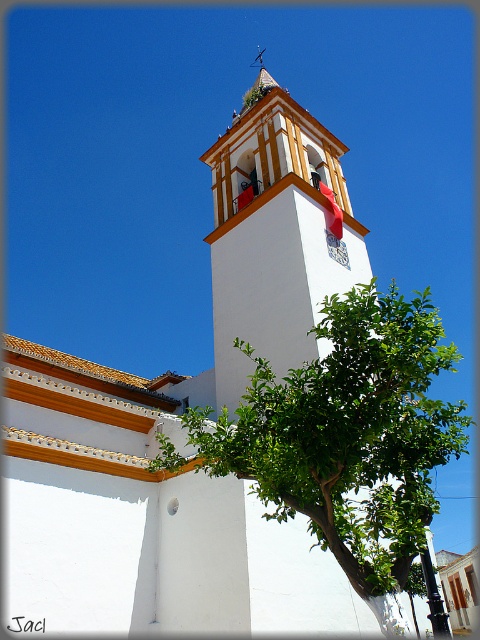
Looking at this image, you are standing in front of the white stucco tower at center and want to walk towards the green leafy tree at center. Which direction should you move to get closer to the tree?

Since the green leafy tree at center is closer to the viewer than the white stucco tower at center, you should move forward towards the tree as it is already in front of the tower.

You are standing at the base of the bell tower and want to plant a new tree in the garden. The garden is located at point (348, 436). There is already a green leafy tree at center. Will the new tree block the view of the bell tower from your current position?

The green leafy tree at center is already present at point (348, 436), so planting another tree there would block the view of the bell tower from your current position.